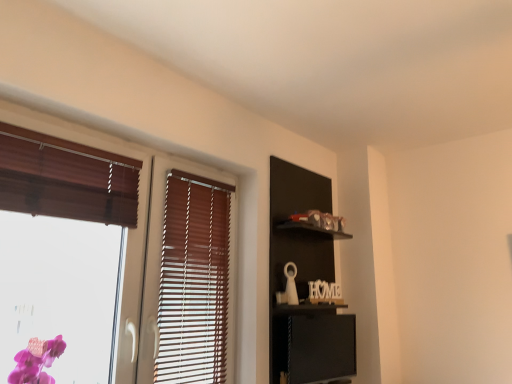
Question: Is black matte shelf at upper right in front of or behind wooden blinds at left in the image?

Choices:
 (A) behind
 (B) front

Answer: (A)

Question: From the image's perspective, is black matte shelf at upper right located above or below wooden blinds at left?

Choices:
 (A) above
 (B) below

Answer: (B)

Question: Looking at their shapes, would you say black matte shelf at upper right is wider or thinner than wooden blinds at left?

Choices:
 (A) thin
 (B) wide

Answer: (B)

Question: Based on their positions, is wooden blinds at left located to the left or right of black matte shelf at upper right?

Choices:
 (A) right
 (B) left

Answer: (B)

Question: From a real-world perspective, is wooden blinds at left physically located above or below black matte shelf at upper right?

Choices:
 (A) below
 (B) above

Answer: (B)

Question: Considering the positions of wooden blinds at left and black matte shelf at upper right in the image, is wooden blinds at left wider or thinner than black matte shelf at upper right?

Choices:
 (A) wide
 (B) thin

Answer: (B)

Question: Relative to black matte shelf at upper right, is wooden blinds at left in front or behind?

Choices:
 (A) front
 (B) behind

Answer: (A)